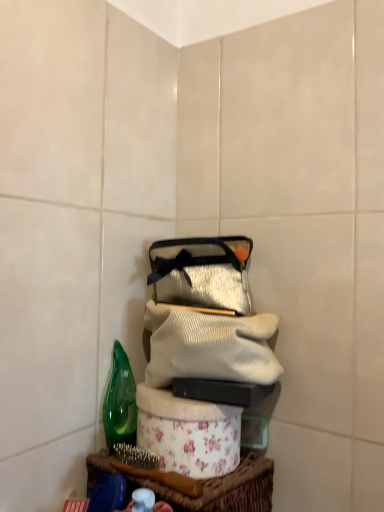
What are the coordinates of `free space above floral fabric basket at lower center (from a real-world perspective)` in the screenshot? It's located at pyautogui.click(x=188, y=450).